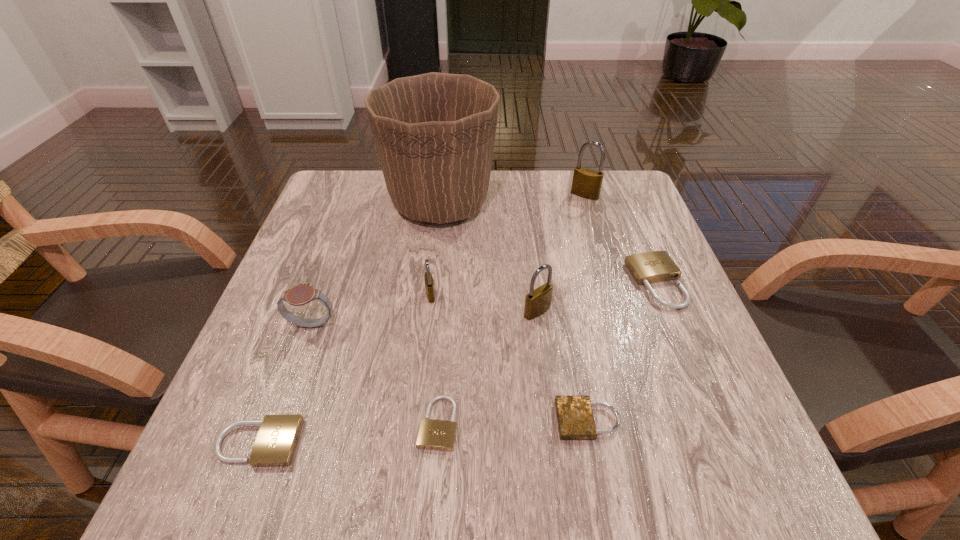
Find the location of a particular element. free location at the left edge is located at coordinates (303, 399).

In the image, there is a desktop. At what (x,y) coordinates should I click in order to perform the action: click on vacant area at the right edge. Please return your answer as a coordinate pair (x, y). The height and width of the screenshot is (540, 960). Looking at the image, I should click on (624, 283).

In order to click on vacant region at the far left corner of the desktop in this screenshot , I will do `click(371, 188)`.

Find the location of a particular element. The width and height of the screenshot is (960, 540). vacant space that's between the smallest beige padlock and the eighth object from left to right is located at coordinates (512, 309).

The width and height of the screenshot is (960, 540). I want to click on vacant point located between the shortest object and the third tallest padlock, so click(x=434, y=359).

Where is `vacant space in between the leftmost padlock and the second beige padlock from left to right`? The width and height of the screenshot is (960, 540). vacant space in between the leftmost padlock and the second beige padlock from left to right is located at coordinates (348, 433).

Where is `empty location between the leftmost padlock and the smallest brass padlock`? Image resolution: width=960 pixels, height=540 pixels. empty location between the leftmost padlock and the smallest brass padlock is located at coordinates (345, 369).

I want to click on free space between the tallest object and the eighth object from left to right, so click(513, 199).

This screenshot has height=540, width=960. What are the coordinates of `free point between the third tallest object and the watch` in the screenshot? It's located at (425, 318).

Find the location of a particular element. vacant space in between the second tallest object and the fifth shortest padlock is located at coordinates (508, 245).